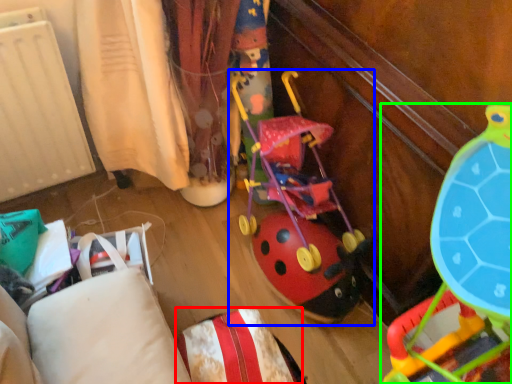
Question: Estimate the real-world distances between objects in this image. Which object is closer to pillow (highlighted by a red box), toy (highlighted by a blue box) or toy (highlighted by a green box)?

Choices:
 (A) toy
 (B) toy

Answer: (B)